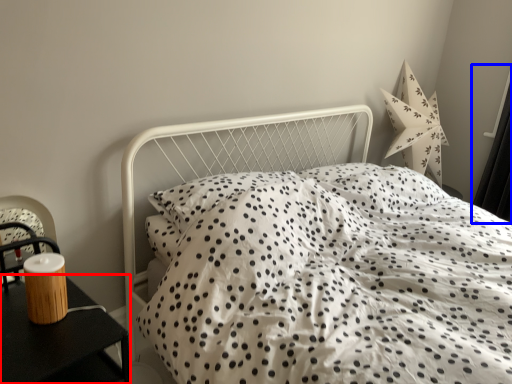
Question: Which of the following is the closest to the observer, nightstand (highlighted by a red box) or curtain (highlighted by a blue box)?

Choices:
 (A) nightstand
 (B) curtain

Answer: (A)